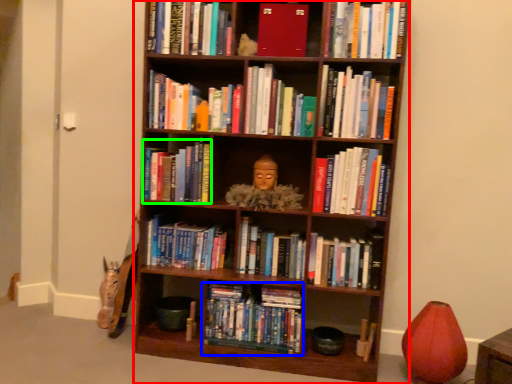
Question: Which is farther away from bookcase (highlighted by a red box)? book (highlighted by a blue box) or book (highlighted by a green box)?

Choices:
 (A) book
 (B) book

Answer: (A)